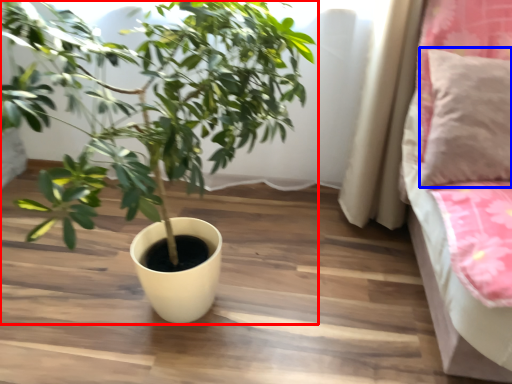
Question: Which point is further to the camera, houseplant (highlighted by a red box) or pillow (highlighted by a blue box)?

Choices:
 (A) houseplant
 (B) pillow

Answer: (B)